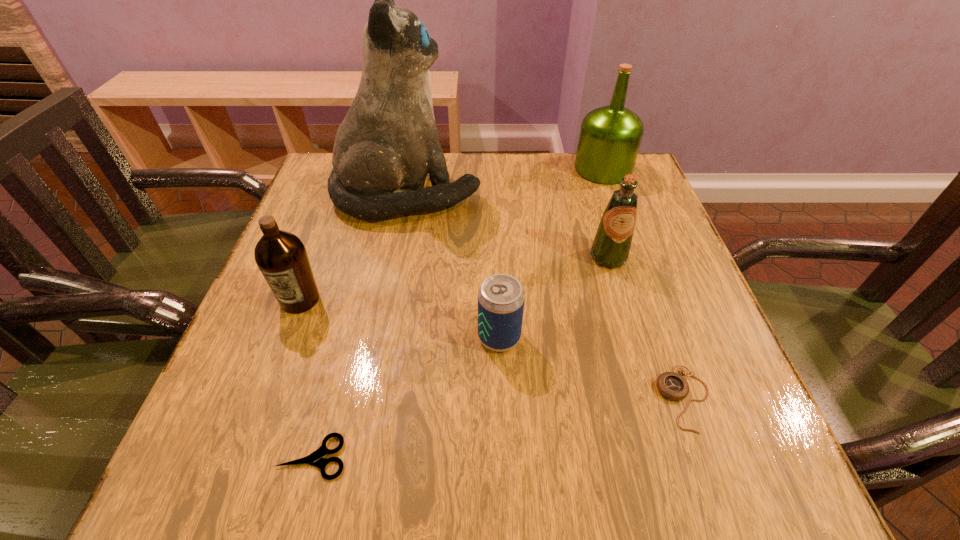
Identify the location of cat. (388, 142).

Where is `the tallest olive oil`? This screenshot has height=540, width=960. the tallest olive oil is located at coordinates (610, 136).

Locate an element on the screen. The width and height of the screenshot is (960, 540). the farthest olive oil is located at coordinates (610, 136).

At what (x,y) coordinates should I click in order to perform the action: click on the third farthest object. Please return your answer as a coordinate pair (x, y). This screenshot has height=540, width=960. Looking at the image, I should click on (612, 243).

You are a GUI agent. You are given a task and a screenshot of the screen. Output one action in this format:
    pyautogui.click(x=<x>, y=<y>)
    Task: Click on the fourth farthest object
    
    Given the screenshot: What is the action you would take?
    pyautogui.click(x=281, y=256)

Locate an element on the screen. The height and width of the screenshot is (540, 960). the leftmost olive oil is located at coordinates [x=281, y=256].

Where is `beer can`? beer can is located at coordinates [501, 297].

Where is `the third nearest object`? The height and width of the screenshot is (540, 960). the third nearest object is located at coordinates (501, 297).

You are a GUI agent. You are given a task and a screenshot of the screen. Output one action in this format:
    pyautogui.click(x=<x>, y=<y>)
    Task: Click on the sixth farthest object
    This screenshot has width=960, height=540.
    Given the screenshot: What is the action you would take?
    pyautogui.click(x=673, y=386)

The height and width of the screenshot is (540, 960). I want to click on pocket watch, so click(x=673, y=386).